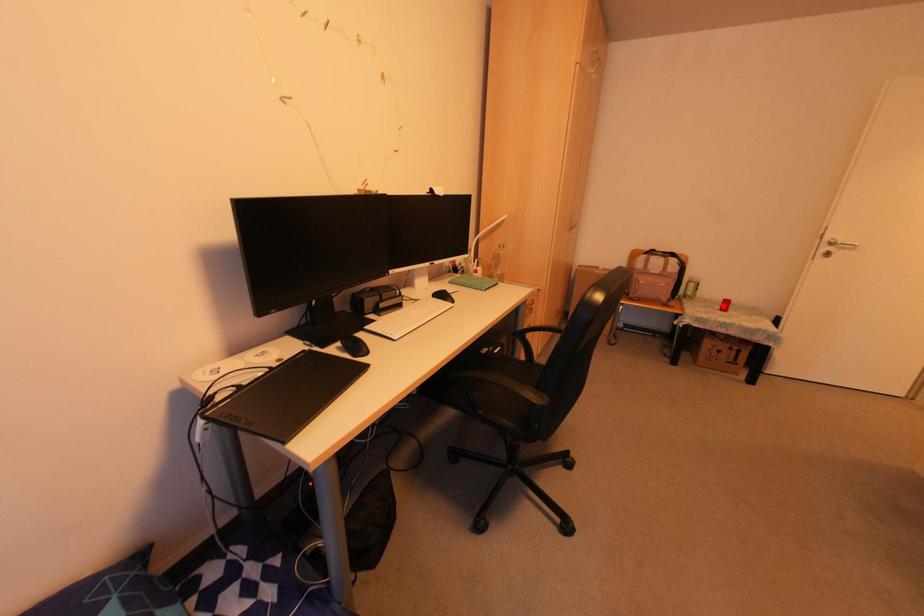
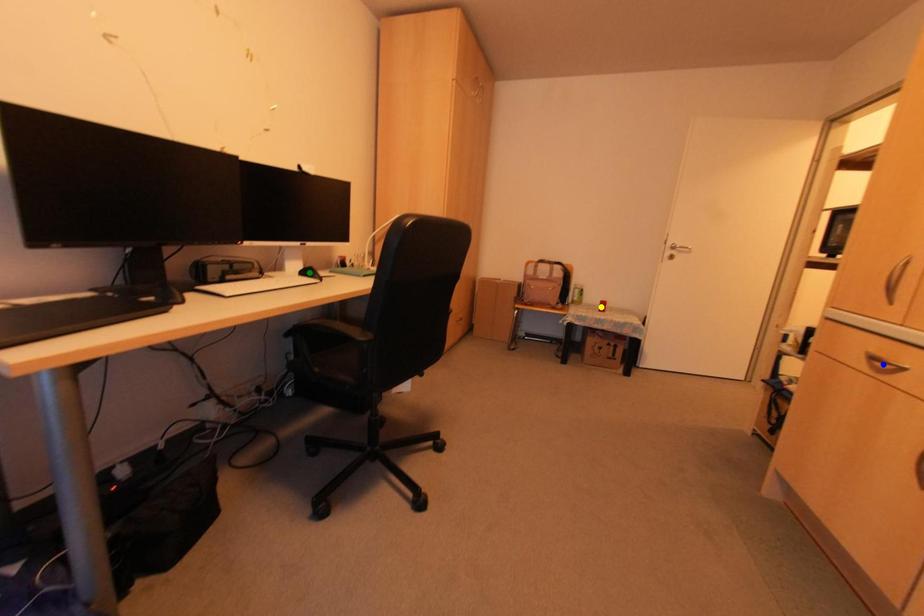
Question: I am providing you with two images of the same scene from different viewpoints. A red point is marked on the first image. You are given multiple points on the second image. In image 2, which mark is for the same physical point as the one in image 1?

Choices:
 (A) blue point
 (B) green point
 (C) yellow point

Answer: (C)